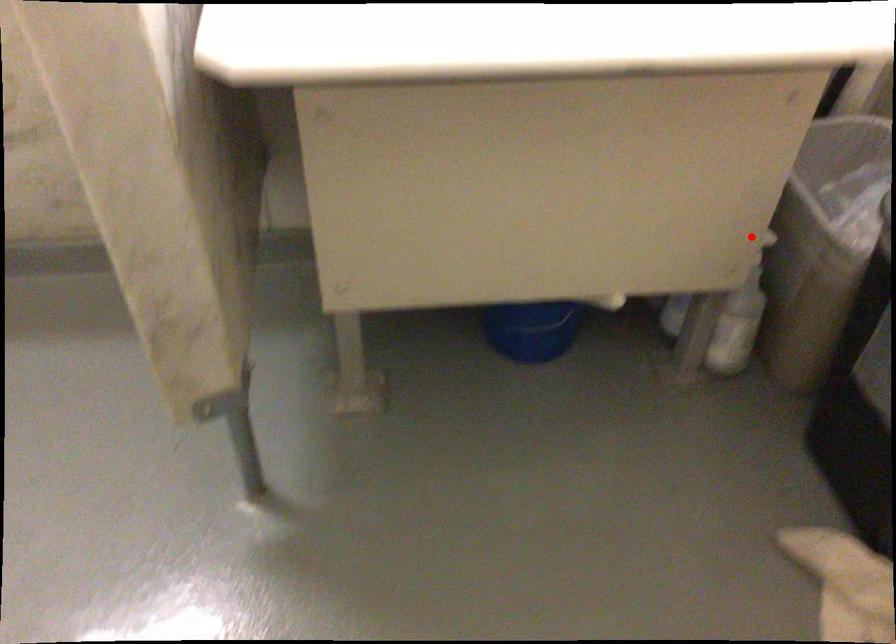
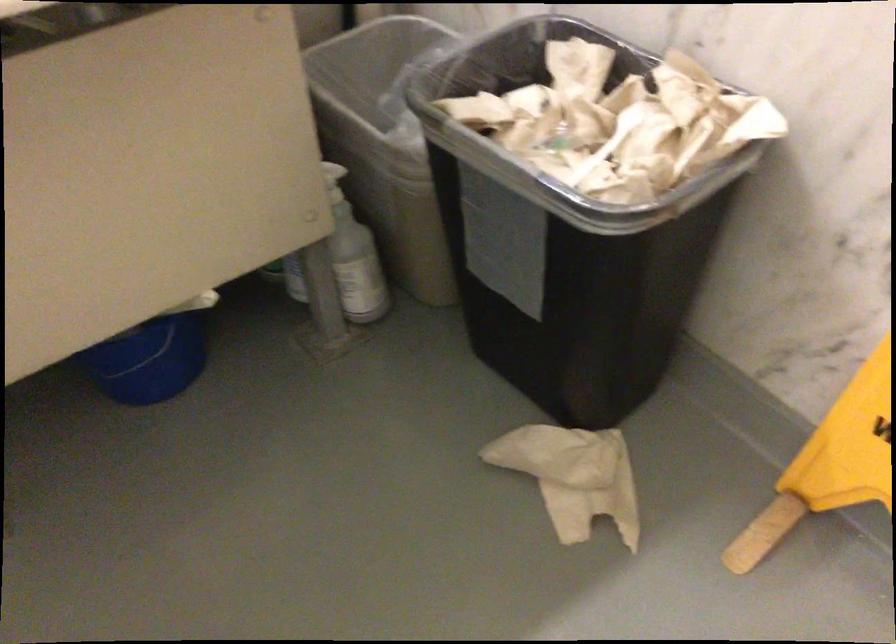
The point at the highlighted location is marked in the first image. Where is the corresponding point in the second image?

(333, 182)